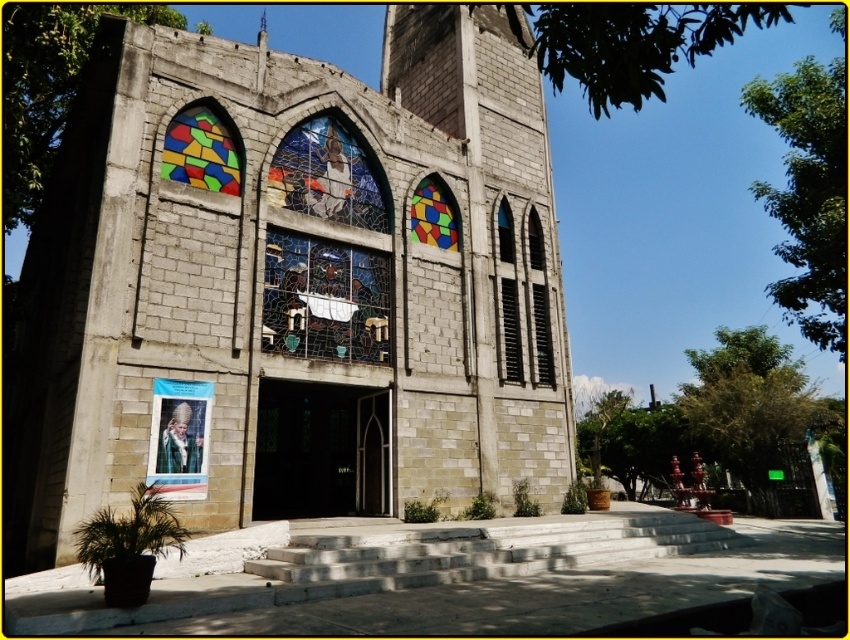
You are standing in front of the church and want to locate the entrance. Based on the coordinates provided, where should you look to find the black glass door at center?

The black glass door at center is located at coordinates point (320, 451).

You are standing in front of the gray stone church at center and the stained glass window at center. Which object is located to the right side?

The stained glass window at center is located to the right side of the gray stone church at center.